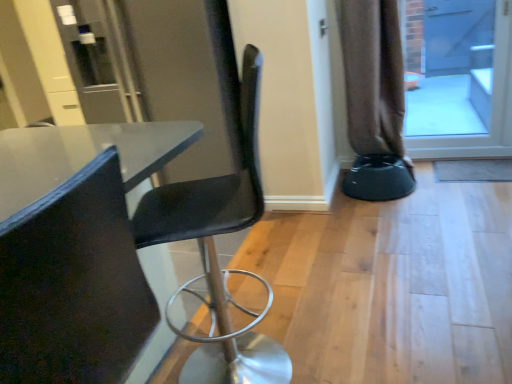
Question: Can you confirm if blue glass screen door at upper right is shorter than brown fabric curtain at right?

Choices:
 (A) yes
 (B) no

Answer: (A)

Question: Does blue glass screen door at upper right have a larger size compared to brown fabric curtain at right?

Choices:
 (A) yes
 (B) no

Answer: (B)

Question: Are blue glass screen door at upper right and brown fabric curtain at right making contact?

Choices:
 (A) no
 (B) yes

Answer: (A)

Question: From the image's perspective, is blue glass screen door at upper right below brown fabric curtain at right?

Choices:
 (A) yes
 (B) no

Answer: (B)

Question: Is blue glass screen door at upper right positioned in front of brown fabric curtain at right?

Choices:
 (A) no
 (B) yes

Answer: (A)

Question: From their relative heights in the image, would you say brown fabric curtain at right is taller or shorter than black plastic bar stool at lower right?

Choices:
 (A) tall
 (B) short

Answer: (A)

Question: Is brown fabric curtain at right wider or thinner than black plastic bar stool at lower right?

Choices:
 (A) thin
 (B) wide

Answer: (A)

Question: From a real-world perspective, is brown fabric curtain at right above or below black plastic bar stool at lower right?

Choices:
 (A) above
 (B) below

Answer: (A)

Question: Would you say brown fabric curtain at right is inside or outside black plastic bar stool at lower right?

Choices:
 (A) outside
 (B) inside

Answer: (A)

Question: Is brown fabric curtain at right wider or thinner than matte black chair at left, positioned as the second chair in back-to-front order?

Choices:
 (A) wide
 (B) thin

Answer: (B)

Question: Considering the positions of brown fabric curtain at right and matte black chair at left, which is the first chair in front-to-back order, in the image, is brown fabric curtain at right bigger or smaller than matte black chair at left, which is the first chair in front-to-back order,?

Choices:
 (A) small
 (B) big

Answer: (A)

Question: In the image, is brown fabric curtain at right positioned in front of or behind matte black chair at left, which is the first chair in front-to-back order?

Choices:
 (A) behind
 (B) front

Answer: (A)

Question: From the image's perspective, relative to matte black chair at left, positioned as the second chair in back-to-front order, is brown fabric curtain at right above or below?

Choices:
 (A) above
 (B) below

Answer: (A)

Question: Considering the positions of matte black chair at center, arranged as the first chair when viewed from the back, and blue glass screen door at upper right in the image, is matte black chair at center, arranged as the first chair when viewed from the back, wider or thinner than blue glass screen door at upper right?

Choices:
 (A) wide
 (B) thin

Answer: (A)

Question: In terms of size, does matte black chair at center, which is the second chair in front-to-back order, appear bigger or smaller than blue glass screen door at upper right?

Choices:
 (A) small
 (B) big

Answer: (B)